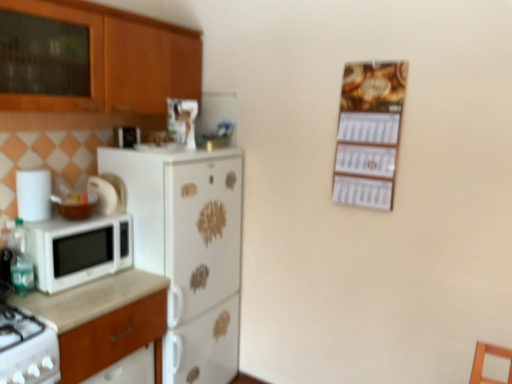
Question: Is wooden cabinet at upper left smaller than wooden calendar at upper right?

Choices:
 (A) yes
 (B) no

Answer: (B)

Question: Is wooden cabinet at upper left far from wooden calendar at upper right?

Choices:
 (A) no
 (B) yes

Answer: (B)

Question: Does wooden cabinet at upper left come in front of wooden calendar at upper right?

Choices:
 (A) yes
 (B) no

Answer: (A)

Question: Can you confirm if wooden cabinet at upper left is shorter than wooden calendar at upper right?

Choices:
 (A) no
 (B) yes

Answer: (B)

Question: Is wooden cabinet at upper left to the right of wooden calendar at upper right from the viewer's perspective?

Choices:
 (A) yes
 (B) no

Answer: (B)

Question: Is wooden cabinet at upper left wider or thinner than wooden calendar at upper right?

Choices:
 (A) thin
 (B) wide

Answer: (B)

Question: Looking at the image, does wooden cabinet at upper left seem bigger or smaller compared to wooden calendar at upper right?

Choices:
 (A) big
 (B) small

Answer: (A)

Question: Considering the relative positions of wooden cabinet at upper left and wooden calendar at upper right in the image provided, is wooden cabinet at upper left to the left or to the right of wooden calendar at upper right?

Choices:
 (A) right
 (B) left

Answer: (B)

Question: From a real-world perspective, is wooden cabinet at upper left above or below wooden calendar at upper right?

Choices:
 (A) below
 (B) above

Answer: (B)

Question: Would you say white glossy toaster at upper left, which ranks as the second appliance in left-to-right order, is to the left or to the right of wooden cabinet at upper left in the picture?

Choices:
 (A) left
 (B) right

Answer: (B)

Question: Considering their positions, is white glossy toaster at upper left, the first appliance in the top-to-bottom sequence, located in front of or behind wooden cabinet at upper left?

Choices:
 (A) behind
 (B) front

Answer: (A)

Question: In terms of size, does white glossy toaster at upper left, which ranks as the second appliance in left-to-right order, appear bigger or smaller than wooden cabinet at upper left?

Choices:
 (A) big
 (B) small

Answer: (B)

Question: Is point (121, 139) closer or farther from the camera than point (163, 72)?

Choices:
 (A) closer
 (B) farther

Answer: (A)

Question: From the image's perspective, is white matte refrigerator at center-left above or below white matte container at left, the 2th appliance viewed from the top?

Choices:
 (A) below
 (B) above

Answer: (A)

Question: Based on their sizes in the image, would you say white matte refrigerator at center-left is bigger or smaller than white matte container at left, the 2th appliance in the back-to-front sequence?

Choices:
 (A) small
 (B) big

Answer: (B)